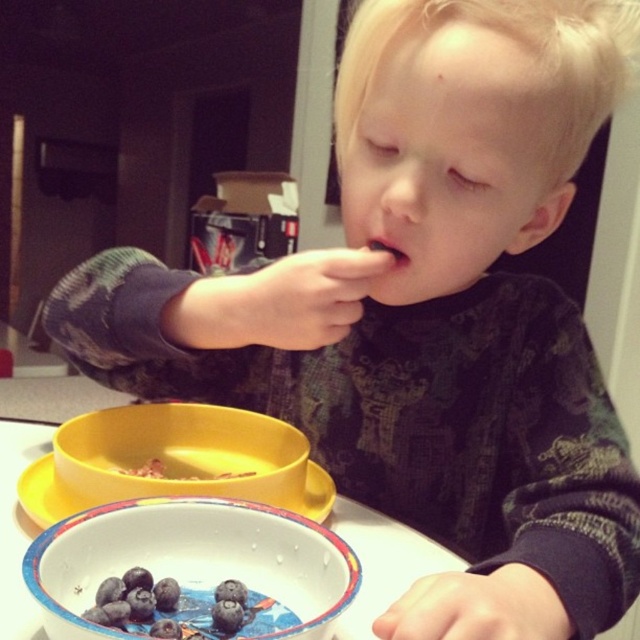
Question: Which object is positioned farthest from the blue glossy bowl at lower center?

Choices:
 (A) blueberry matte at lower left
 (B) white glossy table at center

Answer: (B)

Question: Is blue glossy bowl at lower center closer to the viewer compared to yellow matte cereal at upper left?

Choices:
 (A) no
 (B) yes

Answer: (B)

Question: Can you confirm if white glossy plate at lower center is thinner than smooth skin at mouth center?

Choices:
 (A) no
 (B) yes

Answer: (A)

Question: Which point is closer to the camera?

Choices:
 (A) (61, 504)
 (B) (182, 477)
 (C) (148, 461)

Answer: (A)

Question: Is white glossy table at center positioned in front of yellow matte cereal at upper left?

Choices:
 (A) no
 (B) yes

Answer: (B)

Question: Which point appears closest to the camera in this image?

Choices:
 (A) (372, 563)
 (B) (51, 467)

Answer: (A)